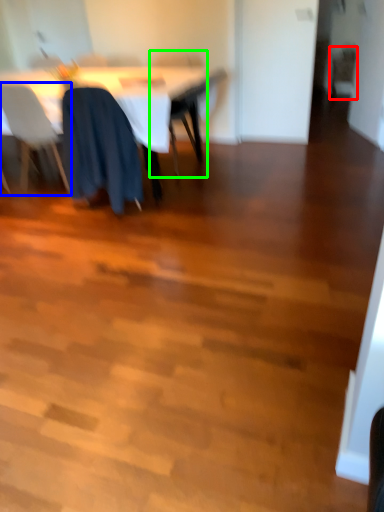
Question: Based on their relative distances, which object is farther from chair (highlighted by a red box)? Choose from chair (highlighted by a blue box) and chair (highlighted by a green box).

Choices:
 (A) chair
 (B) chair

Answer: (A)